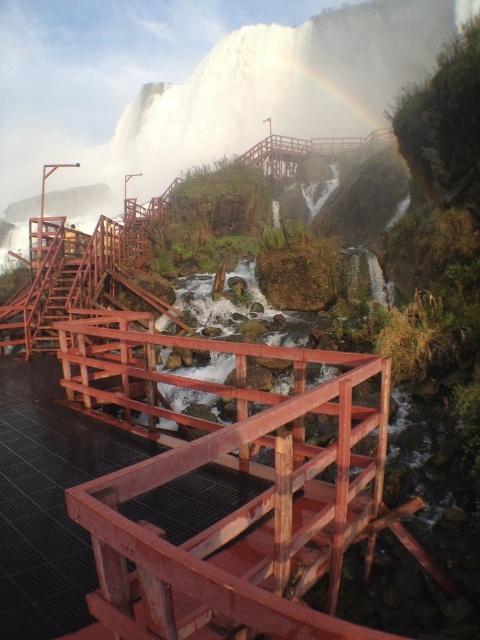
You are standing on the red metal walkways near the waterfall and want to take a photo of both the point at coordinates point (276, 481) and the point at coordinates point (333, 150). Which point should you focus on first to ensure both are in the frame?

You should focus on point (276, 481) first because it is closer to you than point (333, 150), ensuring both points are within the camera frame.

You are a hiker who wants to cross from the matte red wooden rail at center to the wooden bridge at center. Given that your backpack has a width of 0.5 meters, can you safely move between them without any obstacles?

The matte red wooden rail at center and wooden bridge at center are 27.94 meters apart. Since your backpack is only 0.5 meters wide, the distance between them is more than sufficient for you to safely move between them without any obstacles.